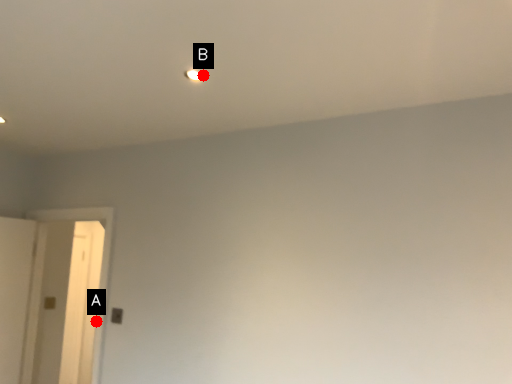
Question: Two points are circled on the image, labeled by A and B beside each circle. Which point appears closest to the camera in this image?

Choices:
 (A) A is closer
 (B) B is closer

Answer: (B)